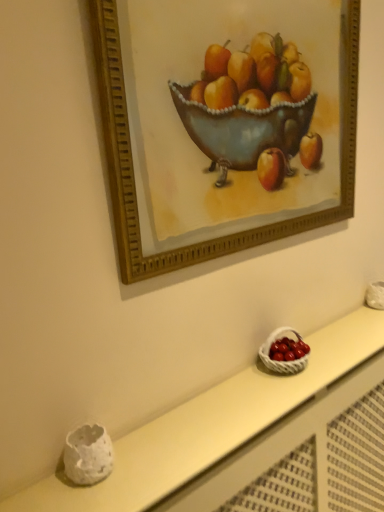
Question: Can you confirm if gold-framed picture at upper center is shorter than white wicker basket at lower right?

Choices:
 (A) yes
 (B) no

Answer: (B)

Question: Does gold-framed picture at upper center lie behind white wicker basket at lower right?

Choices:
 (A) no
 (B) yes

Answer: (A)

Question: Is gold-framed picture at upper center oriented away from white wicker basket at lower right?

Choices:
 (A) no
 (B) yes

Answer: (A)

Question: Is gold-framed picture at upper center smaller than white wicker basket at lower right?

Choices:
 (A) yes
 (B) no

Answer: (B)

Question: Can you confirm if gold-framed picture at upper center is positioned to the right of white wicker basket at lower right?

Choices:
 (A) yes
 (B) no

Answer: (B)

Question: Is gold-framed picture at upper center oriented towards white wicker basket at lower right?

Choices:
 (A) no
 (B) yes

Answer: (A)

Question: Is white wicker basket at lower right wider than white wicker basket at lower right?

Choices:
 (A) yes
 (B) no

Answer: (A)

Question: Does white wicker basket at lower right lie in front of white wicker basket at lower right?

Choices:
 (A) yes
 (B) no

Answer: (A)

Question: From the image's perspective, is white wicker basket at lower right below white wicker basket at lower right?

Choices:
 (A) no
 (B) yes

Answer: (B)

Question: Does white wicker basket at lower right appear on the left side of white wicker basket at lower right?

Choices:
 (A) no
 (B) yes

Answer: (A)

Question: Would you say white wicker basket at lower right is part of white wicker basket at lower right's contents?

Choices:
 (A) yes
 (B) no

Answer: (B)

Question: Does white wicker basket at lower right have a lesser width compared to white wicker basket at lower right?

Choices:
 (A) yes
 (B) no

Answer: (B)

Question: Can you confirm if white wicker basket at lower right is wider than white wicker basket at lower right?

Choices:
 (A) yes
 (B) no

Answer: (B)